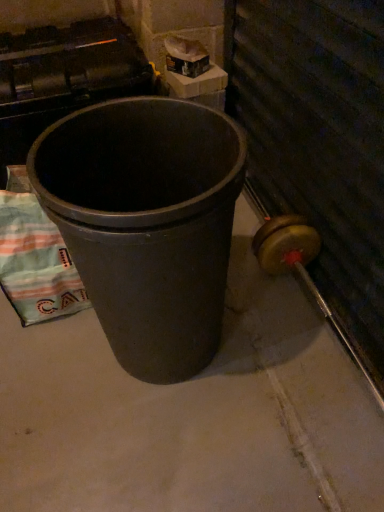
Measure the distance between matte gray trash can at center and camera.

A distance of 24.45 inches exists between matte gray trash can at center and camera.

At what (x,y) coordinates should I click in order to perform the action: click on matte gray trash can at center. Please return your answer as a coordinate pair (x, y). Looking at the image, I should click on (147, 223).

What do you see at coordinates (147, 223) in the screenshot?
I see `matte gray trash can at center` at bounding box center [147, 223].

The image size is (384, 512). I want to click on matte gray trash can at center, so click(x=147, y=223).